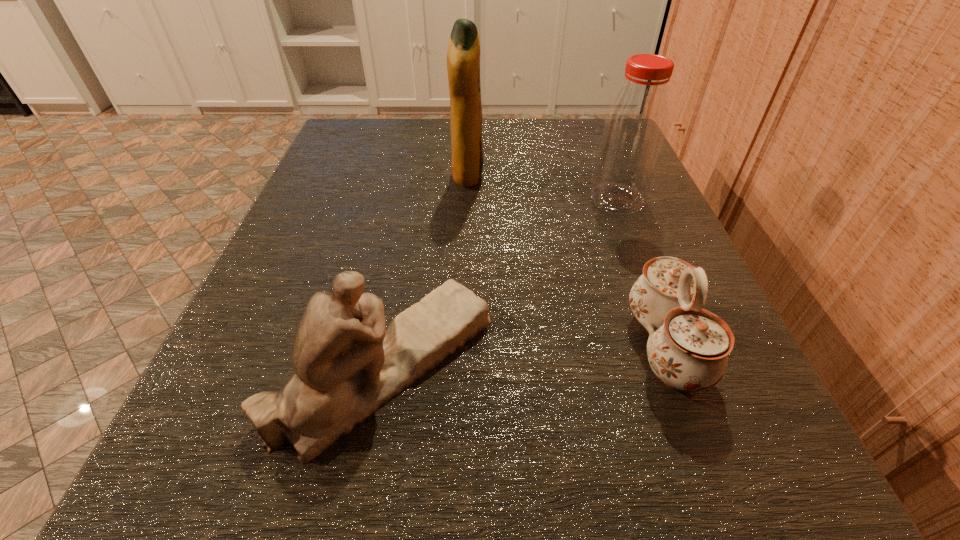
Locate an element on the screen. This screenshot has width=960, height=540. free spot between the figurine and the detergent is located at coordinates (426, 270).

At what (x,y) coordinates should I click in order to perform the action: click on free spot between the figurine and the shortest object. Please return your answer as a coordinate pair (x, y). Looking at the image, I should click on (525, 356).

Locate an element on the screen. The width and height of the screenshot is (960, 540). free space between the bottle and the figurine is located at coordinates (501, 282).

Identify which object is located as the nearest to the detergent. Please provide its 2D coordinates. Your answer should be formatted as a tuple, i.e. [(x, y)], where the tuple contains the x and y coordinates of a point satisfying the conditions above.

[(635, 125)]

Locate which object is the third closest to the detergent. Please provide its 2D coordinates. Your answer should be formatted as a tuple, i.e. [(x, y)], where the tuple contains the x and y coordinates of a point satisfying the conditions above.

[(688, 346)]

Find the location of a particular element. free space that satisfies the following two spatial constraints: 1. on the front side of the bottle; 2. by the handle of the shortest object is located at coordinates (675, 347).

Identify the location of vacant space that satisfies the following two spatial constraints: 1. on the back side of the bottle; 2. on the label of the detergent. [x=608, y=176].

What are the coordinates of `vacant space that satisfies the following two spatial constraints: 1. on the front side of the bottle; 2. by the handle of the shortest object` in the screenshot? It's located at (675, 347).

This screenshot has height=540, width=960. Identify the location of free space that satisfies the following two spatial constraints: 1. on the label of the bottle; 2. on the right side of the detergent. (467, 199).

You are a GUI agent. You are given a task and a screenshot of the screen. Output one action in this format:
    pyautogui.click(x=<x>, y=<y>)
    Task: Click on the vacant space that satisfies the following two spatial constraints: 1. on the front side of the bottle; 2. by the handle of the chinaware
    
    Given the screenshot: What is the action you would take?
    pyautogui.click(x=675, y=347)